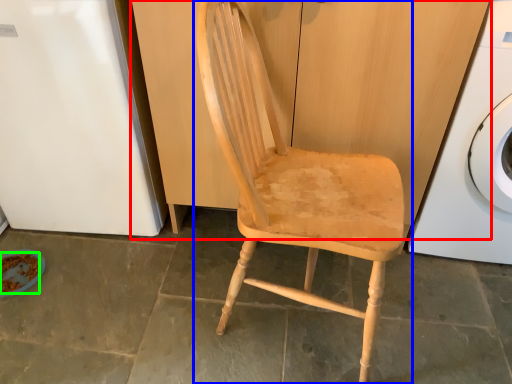
Question: Which object is positioned farthest from dresser (highlighted by a red box)? Select from chair (highlighted by a blue box) and food (highlighted by a green box).

Choices:
 (A) chair
 (B) food

Answer: (B)